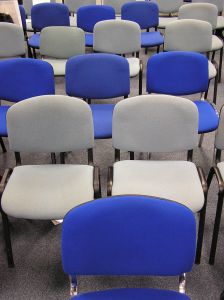
Locate an element on the screen. chair seat is located at coordinates coord(39,196).